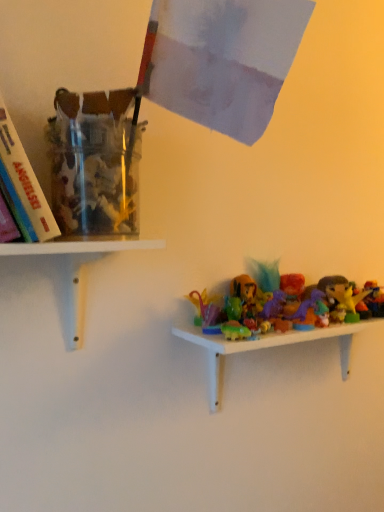
The image size is (384, 512). What do you see at coordinates (77, 269) in the screenshot?
I see `white matte shelf at lower left, marked as the second shelf in a bottom-to-top arrangement` at bounding box center [77, 269].

Locate an element on the screen. The width and height of the screenshot is (384, 512). white matte shelf at lower left, marked as the second shelf in a bottom-to-top arrangement is located at coordinates (77, 269).

In order to face plastic toy figures at lower right, which is the first shelf from right to left, should I rotate leftwards or rightwards?

You should rotate right by 16.847 degrees.

What do you see at coordinates (267, 347) in the screenshot? I see `plastic toy figures at lower right, marked as the 2th shelf in a top-to-bottom arrangement` at bounding box center [267, 347].

Find the location of a particular element. plastic toy figures at lower right, the second shelf in the left-to-right sequence is located at coordinates (267, 347).

How much space does plastic toy figures at lower right, placed as the 1th shelf when sorted from bottom to top, occupy vertically?

7.89 inches.

Where is `white matte shelf at lower left, marked as the second shelf in a bottom-to-top arrangement`? The height and width of the screenshot is (512, 384). white matte shelf at lower left, marked as the second shelf in a bottom-to-top arrangement is located at coordinates (77, 269).

Does plastic toy figures at lower right, placed as the 1th shelf when sorted from bottom to top, appear on the left side of white matte shelf at lower left, positioned as the first shelf in top-to-bottom order?

No.

Is plastic toy figures at lower right, which is the first shelf from right to left, in front of white matte shelf at lower left, positioned as the first shelf in top-to-bottom order?

No, the depth of plastic toy figures at lower right, which is the first shelf from right to left, is greater than that of white matte shelf at lower left, positioned as the first shelf in top-to-bottom order.

Which is in front, point (213, 355) or point (45, 253)?

The point (45, 253) is closer to the camera.

Looking at this image, from the image's perspective, does plastic toy figures at lower right, marked as the 2th shelf in a top-to-bottom arrangement, appear higher than white matte shelf at lower left, marked as the second shelf in a bottom-to-top arrangement?

No, from the image's perspective, plastic toy figures at lower right, marked as the 2th shelf in a top-to-bottom arrangement, is not on top of white matte shelf at lower left, marked as the second shelf in a bottom-to-top arrangement.

Based on the photo, from a real-world perspective, which is physically above, plastic toy figures at lower right, placed as the 1th shelf when sorted from bottom to top, or white matte shelf at lower left, marked as the second shelf in a bottom-to-top arrangement?

From a 3D spatial view, white matte shelf at lower left, marked as the second shelf in a bottom-to-top arrangement, is above.

Is plastic toy figures at lower right, the second shelf in the left-to-right sequence, thinner than white matte shelf at lower left, which is the 1th shelf from left to right?

Yes.

Can you confirm if plastic toy figures at lower right, placed as the 1th shelf when sorted from bottom to top, is taller than white matte shelf at lower left, acting as the second shelf starting from the right?

Yes.

Which of these two, plastic toy figures at lower right, the second shelf in the left-to-right sequence, or white matte shelf at lower left, positioned as the first shelf in top-to-bottom order, is bigger?

With larger size is plastic toy figures at lower right, the second shelf in the left-to-right sequence.

Is plastic toy figures at lower right, the second shelf in the left-to-right sequence, surrounding white matte shelf at lower left, which is the 1th shelf from left to right?

No.

Are plastic toy figures at lower right, marked as the 2th shelf in a top-to-bottom arrangement, and white matte shelf at lower left, positioned as the first shelf in top-to-bottom order, beside each other?

plastic toy figures at lower right, marked as the 2th shelf in a top-to-bottom arrangement, and white matte shelf at lower left, positioned as the first shelf in top-to-bottom order, are clearly separated.

Is plastic toy figures at lower right, placed as the 1th shelf when sorted from bottom to top, facing away from white matte shelf at lower left, which is the 1th shelf from left to right?

No, plastic toy figures at lower right, placed as the 1th shelf when sorted from bottom to top, is not facing the opposite direction of white matte shelf at lower left, which is the 1th shelf from left to right.

Locate an element on the screen. The image size is (384, 512). shelf that is on the left side of plastic toy figures at lower right, which is the first shelf from right to left is located at coordinates (77, 269).

Which is more to the right, white matte shelf at lower left, acting as the second shelf starting from the right, or plastic toy figures at lower right, the second shelf in the left-to-right sequence?

plastic toy figures at lower right, the second shelf in the left-to-right sequence, is more to the right.

Considering the relative positions of white matte shelf at lower left, which is the 1th shelf from left to right, and plastic toy figures at lower right, the second shelf in the left-to-right sequence, in the image provided, is white matte shelf at lower left, which is the 1th shelf from left to right, behind plastic toy figures at lower right, the second shelf in the left-to-right sequence,?

No.

Considering the positions of point (69, 316) and point (342, 334), is point (69, 316) closer or farther from the camera than point (342, 334)?

Clearly, point (69, 316) is closer to the camera than point (342, 334).

From the image's perspective, is white matte shelf at lower left, which is the 1th shelf from left to right, beneath plastic toy figures at lower right, the second shelf in the left-to-right sequence?

Incorrect, from the image's perspective, white matte shelf at lower left, which is the 1th shelf from left to right, is higher than plastic toy figures at lower right, the second shelf in the left-to-right sequence.

From a real-world perspective, is white matte shelf at lower left, positioned as the first shelf in top-to-bottom order, below plastic toy figures at lower right, marked as the 2th shelf in a top-to-bottom arrangement?

No, from a real-world perspective, white matte shelf at lower left, positioned as the first shelf in top-to-bottom order, is not below plastic toy figures at lower right, marked as the 2th shelf in a top-to-bottom arrangement.

Is white matte shelf at lower left, marked as the second shelf in a bottom-to-top arrangement, wider or thinner than plastic toy figures at lower right, placed as the 1th shelf when sorted from bottom to top?

Clearly, white matte shelf at lower left, marked as the second shelf in a bottom-to-top arrangement, has more width compared to plastic toy figures at lower right, placed as the 1th shelf when sorted from bottom to top.

Can you confirm if white matte shelf at lower left, positioned as the first shelf in top-to-bottom order, is shorter than plastic toy figures at lower right, placed as the 1th shelf when sorted from bottom to top?

Correct, white matte shelf at lower left, positioned as the first shelf in top-to-bottom order, is not as tall as plastic toy figures at lower right, placed as the 1th shelf when sorted from bottom to top.

Who is smaller, white matte shelf at lower left, which is the 1th shelf from left to right, or plastic toy figures at lower right, the second shelf in the left-to-right sequence?

Smaller between the two is white matte shelf at lower left, which is the 1th shelf from left to right.

Looking at this image, can plastic toy figures at lower right, placed as the 1th shelf when sorted from bottom to top, be found inside white matte shelf at lower left, which is the 1th shelf from left to right?

No, plastic toy figures at lower right, placed as the 1th shelf when sorted from bottom to top, is not a part of white matte shelf at lower left, which is the 1th shelf from left to right.

Consider the image. Is white matte shelf at lower left, positioned as the first shelf in top-to-bottom order, beside plastic toy figures at lower right, which is the first shelf from right to left?

They are not placed beside each other.

Is white matte shelf at lower left, acting as the second shelf starting from the right, oriented away from plastic toy figures at lower right, marked as the 2th shelf in a top-to-bottom arrangement?

No.

How much distance is there between white matte shelf at lower left, which is the 1th shelf from left to right, and plastic toy figures at lower right, placed as the 1th shelf when sorted from bottom to top?

31.44 centimeters.

This screenshot has height=512, width=384. I want to click on shelf above the plastic toy figures at lower right, which is the first shelf from right to left (from a real-world perspective), so click(77, 269).

Locate an element on the screen. shelf above the plastic toy figures at lower right, marked as the 2th shelf in a top-to-bottom arrangement (from the image's perspective) is located at coordinates (77, 269).

Identify the location of shelf to the right of white matte shelf at lower left, marked as the second shelf in a bottom-to-top arrangement. (267, 347).